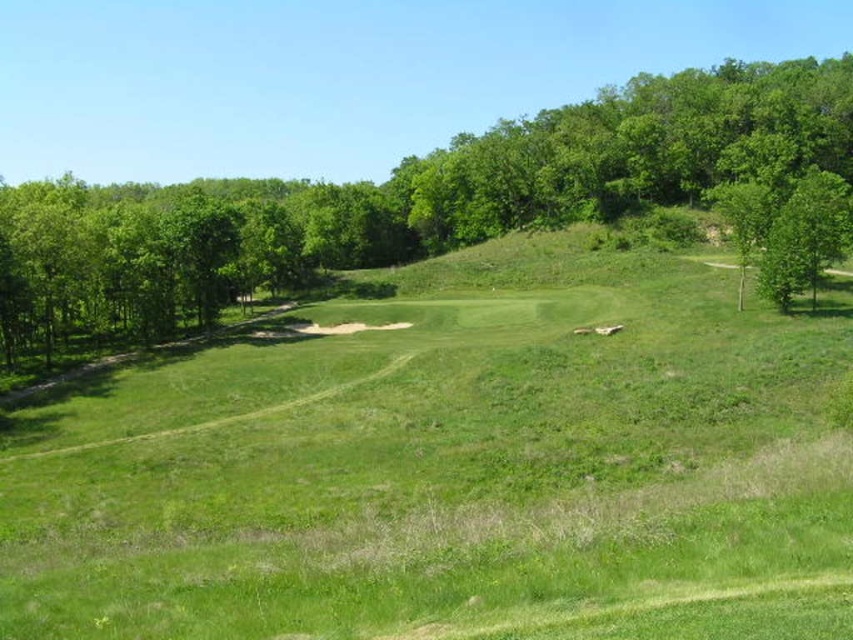
Question: Which object is positioned farthest from the green leafy tree at right?

Choices:
 (A) green leafy tree at upper left
 (B) green grassy field at center

Answer: (A)

Question: Does green grassy field at center lie in front of green leafy tree at upper left?

Choices:
 (A) yes
 (B) no

Answer: (A)

Question: Does green grassy field at center have a greater width compared to green leafy tree at upper left?

Choices:
 (A) yes
 (B) no

Answer: (B)

Question: Which point is closer to the camera taking this photo?

Choices:
 (A) (776, 292)
 (B) (595, 216)

Answer: (A)

Question: Can you confirm if green grassy field at center is positioned below green leafy tree at upper left?

Choices:
 (A) no
 (B) yes

Answer: (B)

Question: Which point is farther to the camera?

Choices:
 (A) green leafy tree at upper left
 (B) green leafy tree at right
 (C) green grassy field at center

Answer: (B)